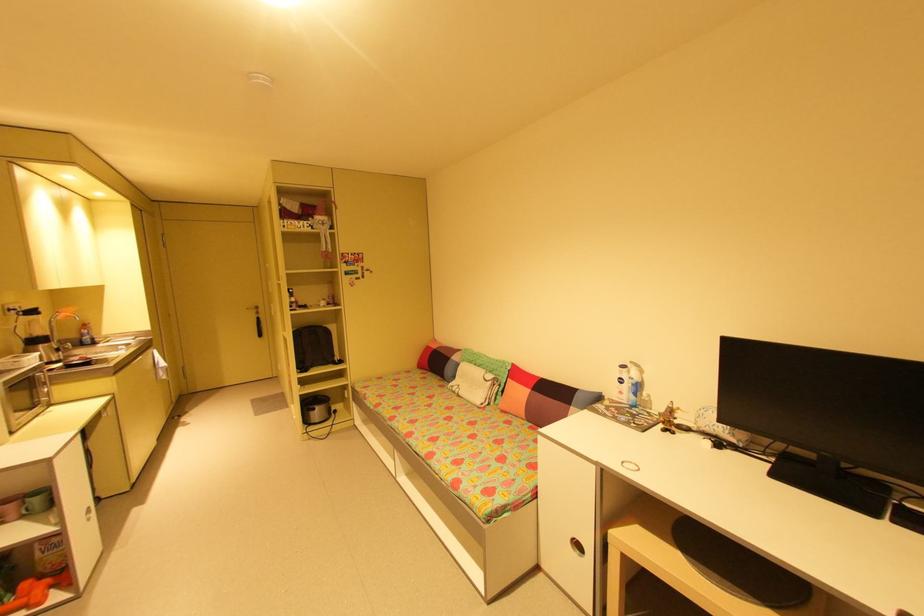
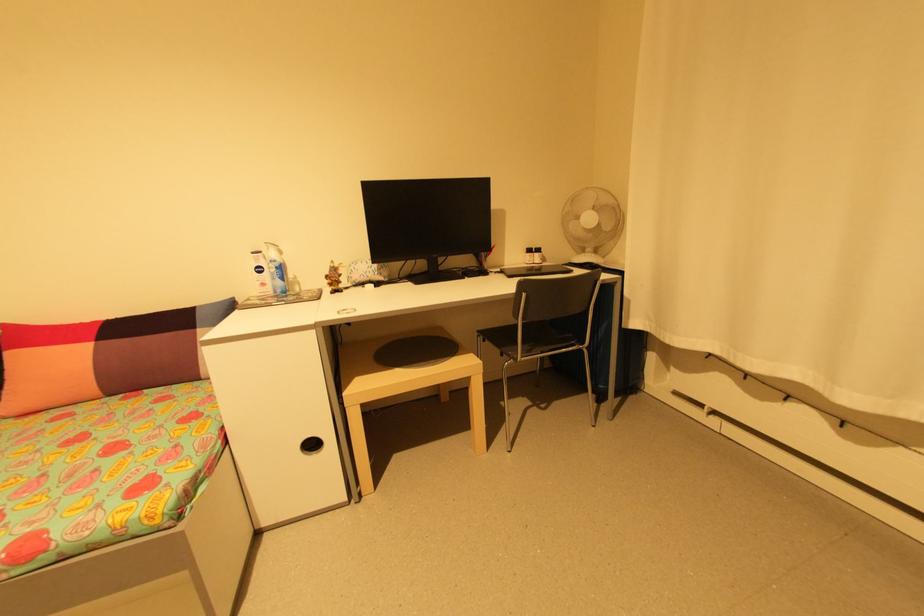
Find the pixel in the second image that matches [517,365] in the first image.

(8, 326)